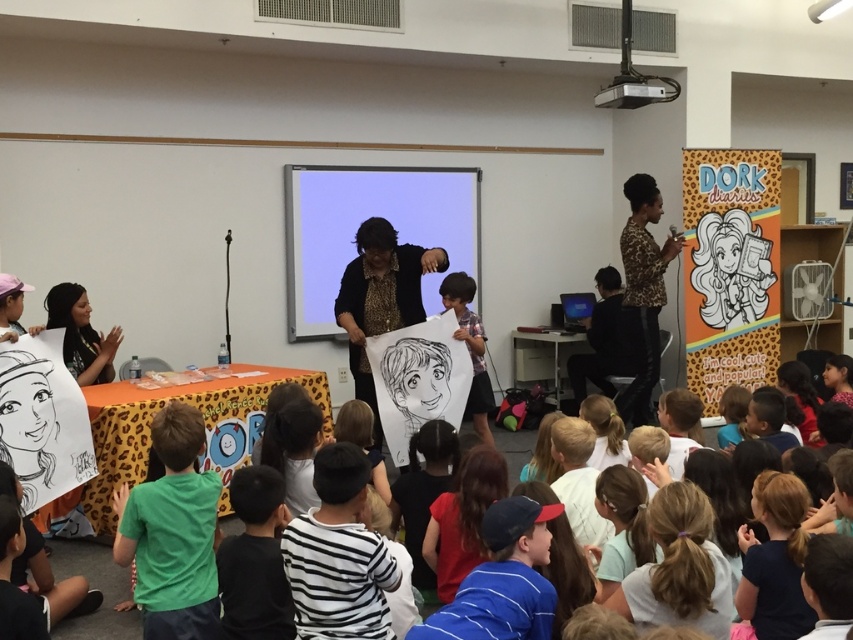
Question: Which point is farther to the camera?

Choices:
 (A) green matte shirt at lower left
 (B) leopard print jacket at upper right
 (C) matte black shirt at center
 (D) matte black board at center

Answer: (D)

Question: Which is nearer to the green matte shirt at lower left?

Choices:
 (A) matte white paper at center
 (B) leopard print jacket at upper right
 (C) matte black board at center

Answer: (A)

Question: Which point is closer to the camera taking this photo?

Choices:
 (A) (397, 323)
 (B) (142, 589)
 (C) (635, 310)
 (D) (469, 408)

Answer: (B)

Question: Is matte black board at center smaller than matte white paper at center?

Choices:
 (A) yes
 (B) no

Answer: (B)

Question: Does matte black shirt at center have a greater width compared to leopard print jacket at upper right?

Choices:
 (A) yes
 (B) no

Answer: (A)

Question: Does green matte shirt at lower left appear on the right side of matte black shirt at center?

Choices:
 (A) no
 (B) yes

Answer: (A)